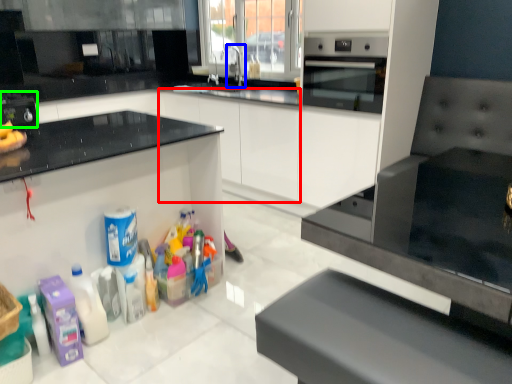
Question: Which is nearer to the cabinetry (highlighted by a red box)? faucet (highlighted by a blue box) or appliance (highlighted by a green box).

Choices:
 (A) faucet
 (B) appliance

Answer: (A)